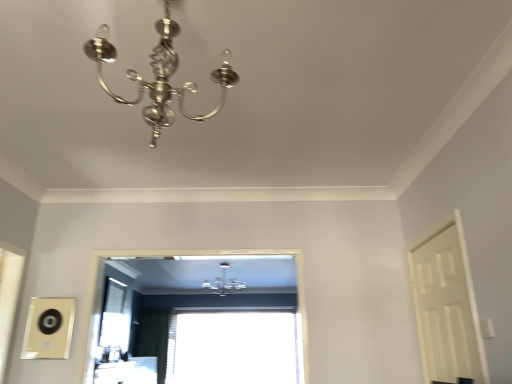
Question: Is satin silver chandelier at upper center, marked as the second lamp in a top-to-bottom arrangement, at the back of transparent glass window at center, the second window in the back-to-front sequence?

Choices:
 (A) no
 (B) yes

Answer: (A)

Question: Can you confirm if transparent glass window at center, which appears as the second window when ordered from the bottom, is shorter than satin silver chandelier at upper center, the 1th lamp from the bottom?

Choices:
 (A) no
 (B) yes

Answer: (A)

Question: Is transparent glass window at center, acting as the 1th window starting from the top, wider than satin silver chandelier at upper center, marked as the second lamp in a top-to-bottom arrangement?

Choices:
 (A) no
 (B) yes

Answer: (B)

Question: From the image's perspective, is transparent glass window at center, which is the first window from front to back, beneath satin silver chandelier at upper center, the 1th lamp from the bottom?

Choices:
 (A) yes
 (B) no

Answer: (B)

Question: Does transparent glass window at center, which appears as the second window when ordered from the bottom, come behind satin silver chandelier at upper center, placed as the 1th lamp when sorted from back to front?

Choices:
 (A) no
 (B) yes

Answer: (A)

Question: Considering the relative sizes of transparent glass window at center, acting as the 1th window starting from the top, and satin silver chandelier at upper center, which is the 2th lamp in front-to-back order, in the image provided, is transparent glass window at center, acting as the 1th window starting from the top, bigger than satin silver chandelier at upper center, which is the 2th lamp in front-to-back order,?

Choices:
 (A) no
 (B) yes

Answer: (B)

Question: Is satin silver chandelier at upper center, marked as the second lamp in a top-to-bottom arrangement, shorter than white matte door at right?

Choices:
 (A) no
 (B) yes

Answer: (B)

Question: Is satin silver chandelier at upper center, marked as the second lamp in a top-to-bottom arrangement, thinner than white matte door at right?

Choices:
 (A) yes
 (B) no

Answer: (B)

Question: Is satin silver chandelier at upper center, marked as the second lamp in a top-to-bottom arrangement, at the left side of white matte door at right?

Choices:
 (A) yes
 (B) no

Answer: (A)

Question: Is satin silver chandelier at upper center, placed as the 1th lamp when sorted from back to front, in front of white matte door at right?

Choices:
 (A) yes
 (B) no

Answer: (B)

Question: Does satin silver chandelier at upper center, which is the 2th lamp in front-to-back order, come behind white matte door at right?

Choices:
 (A) yes
 (B) no

Answer: (A)

Question: Can you see satin silver chandelier at upper center, placed as the 1th lamp when sorted from back to front, touching white matte door at right?

Choices:
 (A) no
 (B) yes

Answer: (A)

Question: From the image's perspective, is polished silver chandelier at upper center, arranged as the 2th lamp when ordered from the bottom, below transparent glass window at center, positioned as the second window in front-to-back order?

Choices:
 (A) yes
 (B) no

Answer: (B)